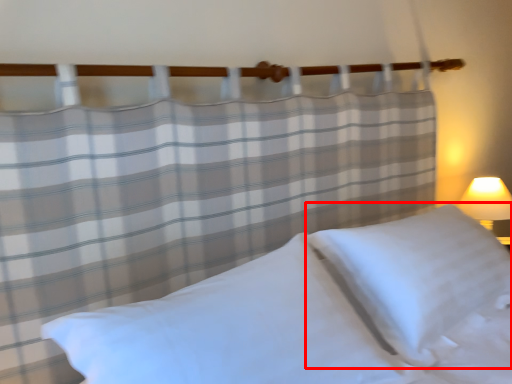
Question: From the image, what is the correct spatial relationship of pillow (annotated by the red box) in relation to pillow?

Choices:
 (A) left
 (B) right

Answer: (B)